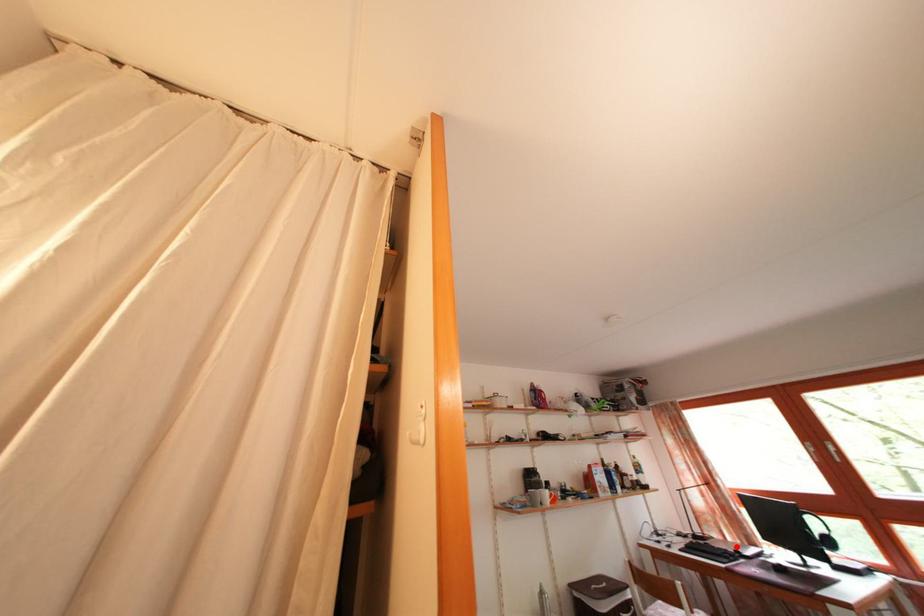
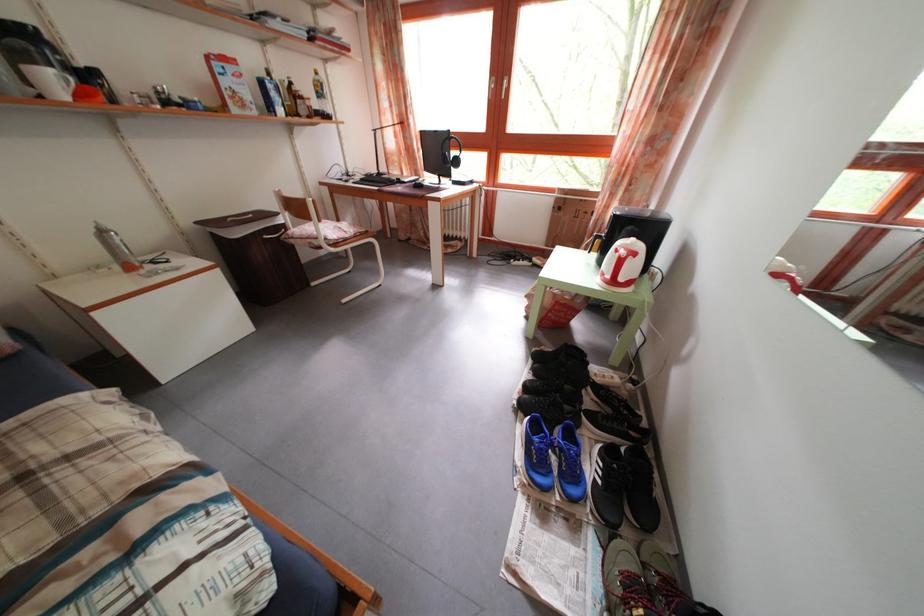
Where in the second image is the point corresponding to the highlighted location from the first image?

(412, 182)